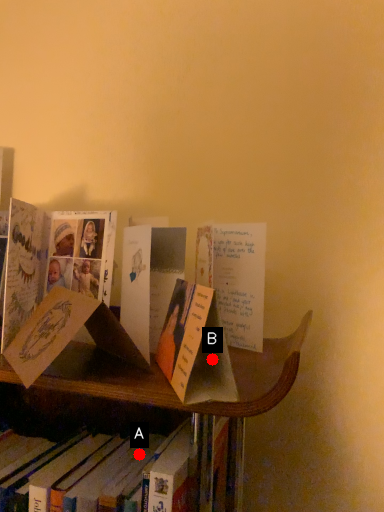
Question: Two points are circled on the image, labeled by A and B beside each circle. Among these points, which one is farthest from the camera?

Choices:
 (A) A is further
 (B) B is further

Answer: (A)